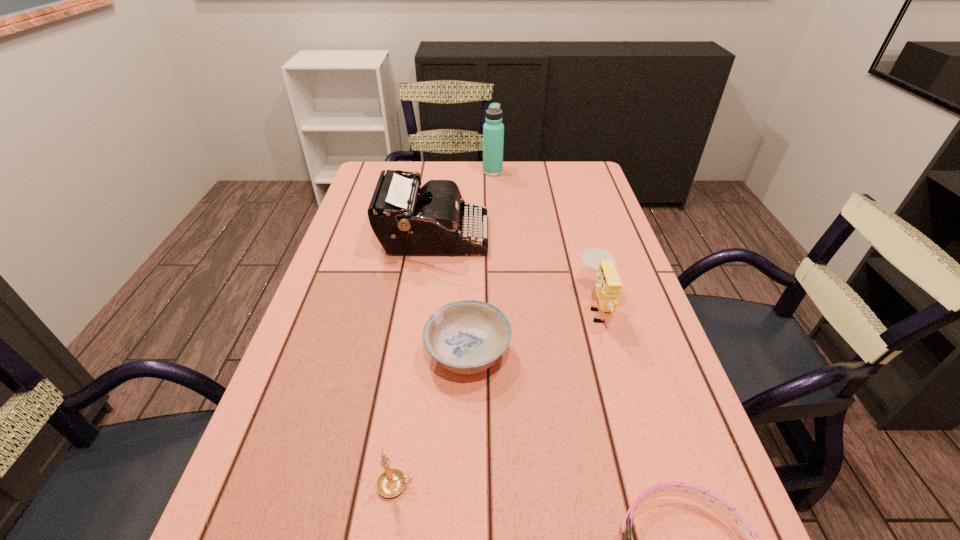
The height and width of the screenshot is (540, 960). What are the coordinates of `thermos bottle` in the screenshot? It's located at (493, 130).

Identify the location of the farthest object. (493, 130).

You are a GUI agent. You are given a task and a screenshot of the screen. Output one action in this format:
    pyautogui.click(x=<x>, y=<y>)
    Task: Click on the second farthest object
    The height and width of the screenshot is (540, 960).
    Given the screenshot: What is the action you would take?
    pyautogui.click(x=407, y=220)

Find the location of `sponge`. sponge is located at coordinates 608,286.

The image size is (960, 540). Identify the location of the third shortest object. 391,482.

Where is `the fifth tallest object`? This screenshot has width=960, height=540. the fifth tallest object is located at coordinates (468, 336).

You are a GUI agent. You are given a task and a screenshot of the screen. Output one action in this format:
    pyautogui.click(x=<x>, y=<y>)
    Task: Click on the vacant area situated on the front of the farthest object
    The image size is (960, 540).
    Given the screenshot: What is the action you would take?
    pyautogui.click(x=494, y=198)

In order to click on vacant space situated on the typing side of the second farthest object in this screenshot , I will do `click(566, 237)`.

Locate an element on the screen. free space located 0.080m on the front-facing side of the sponge is located at coordinates (546, 307).

You are a GUI agent. You are given a task and a screenshot of the screen. Output one action in this format:
    pyautogui.click(x=<x>, y=<y>)
    Task: Click on the blank space located 0.090m on the front-facing side of the sponge
    
    Given the screenshot: What is the action you would take?
    pyautogui.click(x=541, y=307)